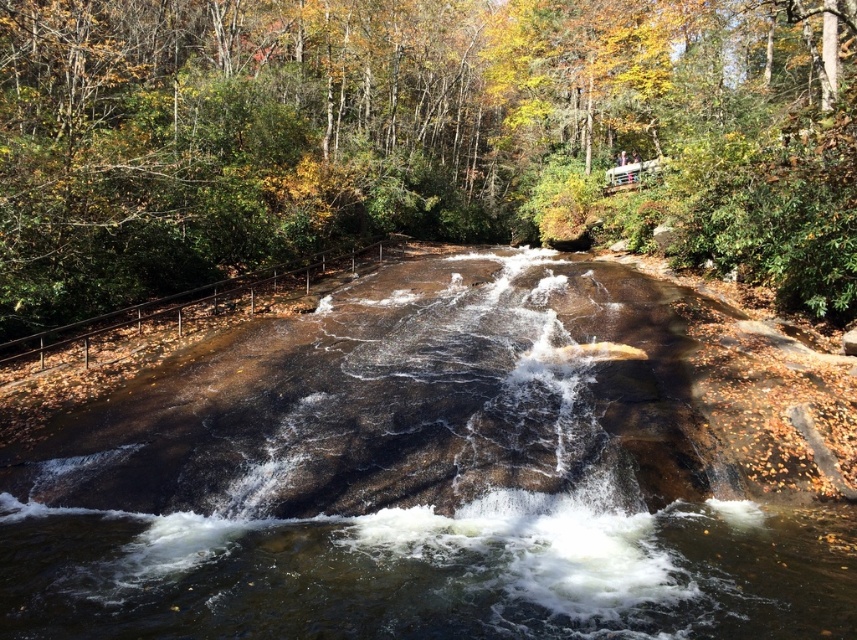
Question: Is brown rock river at center below brown textured rock at center?

Choices:
 (A) no
 (B) yes

Answer: (B)

Question: Which point is farther to the camera?

Choices:
 (A) 399,616
 (B) 766,250

Answer: (B)

Question: Does brown rock river at center come behind brown textured rock at center?

Choices:
 (A) yes
 (B) no

Answer: (B)

Question: Which object is closer to the camera taking this photo?

Choices:
 (A) brown rock river at center
 (B) brown textured rock at center

Answer: (A)

Question: Among these points, which one is nearest to the camera?

Choices:
 (A) (604, 330)
 (B) (453, 3)

Answer: (A)

Question: Is brown rock river at center positioned in front of brown textured rock at center?

Choices:
 (A) yes
 (B) no

Answer: (A)